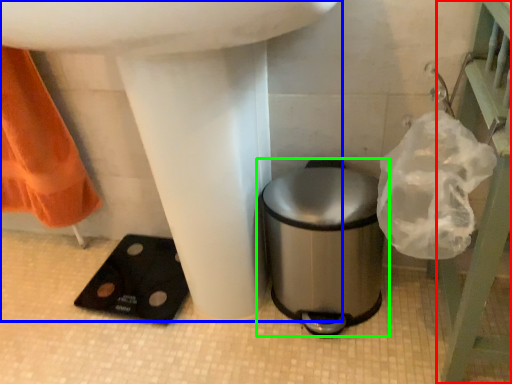
Question: Which object is positioned closest to balustrade (highlighted by a red box)? Select from sink (highlighted by a blue box) and waste container (highlighted by a green box).

Choices:
 (A) sink
 (B) waste container

Answer: (B)